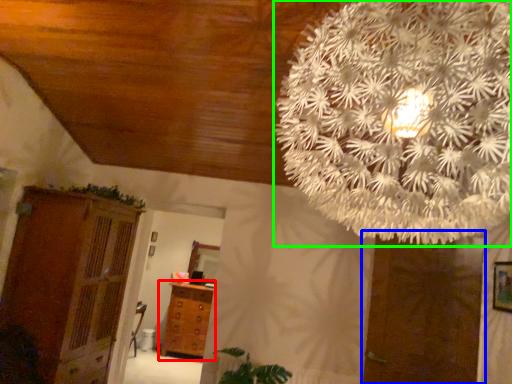
Question: Which is farther away from chest of drawers (highlighted by a red box)? door (highlighted by a blue box) or flower (highlighted by a green box)?

Choices:
 (A) door
 (B) flower

Answer: (B)